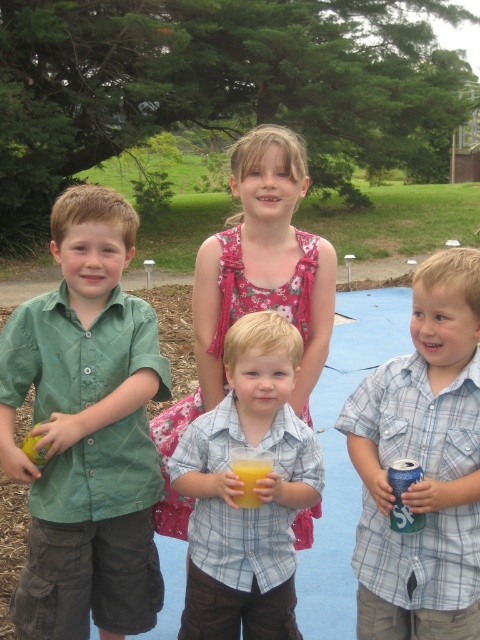
You are a photographer trying to capture a clear shot of the blue plaid shirt at center and the yellow matte apple at left. Since you want both subjects to be in focus, which one should you focus on first?

The blue plaid shirt at center is in front of the yellow matte apple at left, so you should focus on the blue plaid shirt at center first to ensure both are in focus.

You are a photographer trying to capture a group photo of the children. The camera is set to focus on the child at the center of the image. Given that the center of the image is at point coordinates of approximately 0.5, 0.5, is the green cotton shirt at left positioned to the left or right of the center?

The green cotton shirt at left is positioned to the left of the center since its coordinates are at (85, 429), which places it to the left of the central point (240, 320).